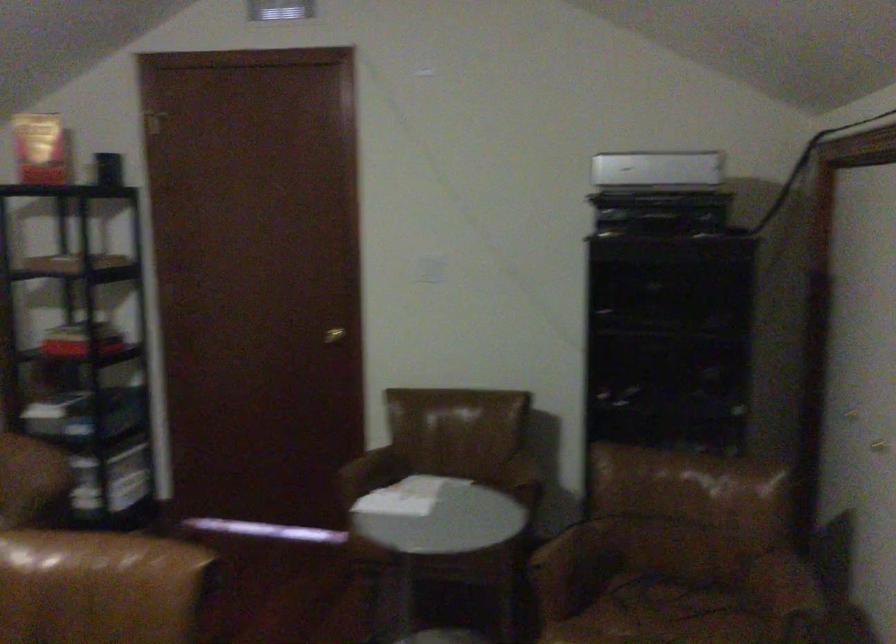
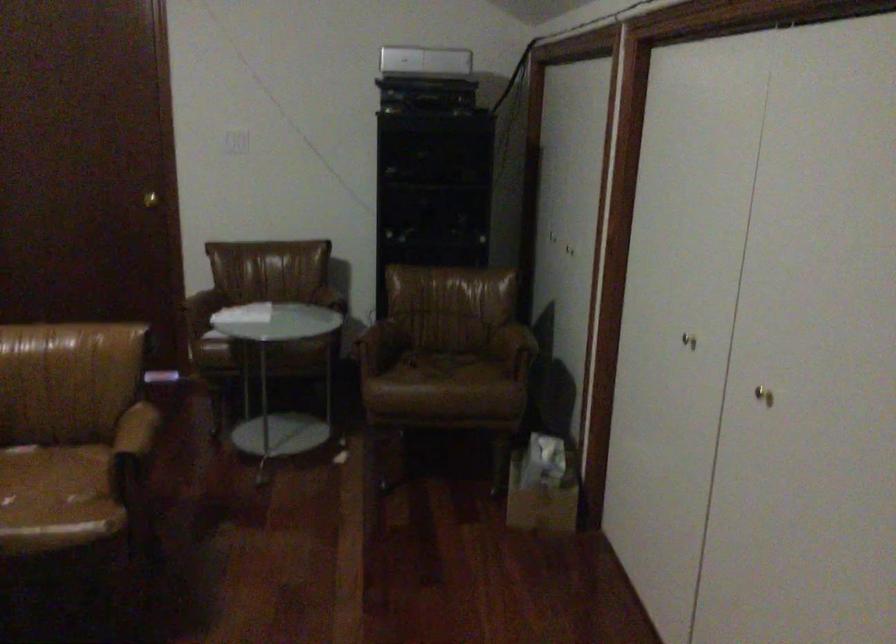
Question: How did the camera likely rotate?

Choices:
 (A) Left
 (B) Right
 (C) Up
 (D) Down

Answer: (B)